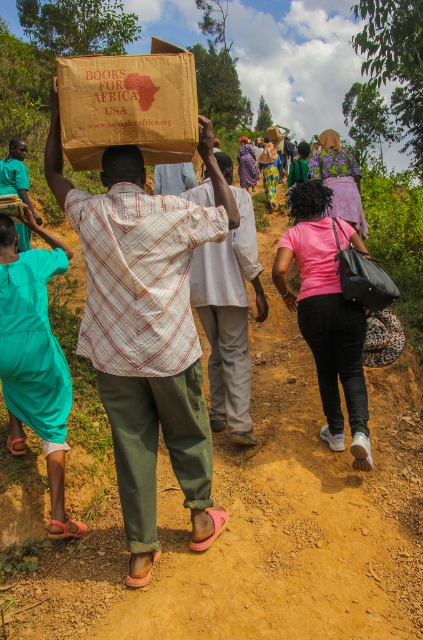
Question: Is plaid fabric shirt at center to the left of matte brown paper bag at center from the viewer's perspective?

Choices:
 (A) yes
 (B) no

Answer: (B)

Question: Which object is the farthest from the plaid fabric shirt at center?

Choices:
 (A) matte green shirt at center
 (B) brown dirt track at center
 (C) brown cardboard box at center
 (D) dark brown hair at center

Answer: (A)

Question: From the image, what is the correct spatial relationship of plaid fabric shirt at center in relation to smooth brown hair at upper center?

Choices:
 (A) left
 (B) right

Answer: (B)

Question: Which point appears farthest from the camera in this image?

Choices:
 (A) (22, 145)
 (B) (406, 467)
 (C) (320, 208)
 (D) (304, 141)

Answer: (D)

Question: Is matte cardboard box at center bigger than plaid fabric shirt at center?

Choices:
 (A) no
 (B) yes

Answer: (A)

Question: Which object is farther from the camera taking this photo?

Choices:
 (A) plaid fabric shirt at center
 (B) matte brown cardboard at center
 (C) brown dirt track at center
 (D) matte green shirt at center

Answer: (D)